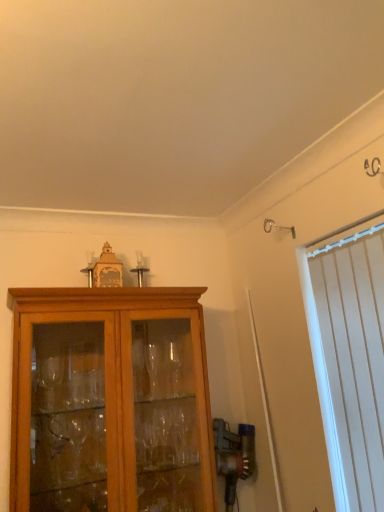
Question: From the image's perspective, is white vertical blinds at right on top of matte wood cabinet at center?

Choices:
 (A) yes
 (B) no

Answer: (A)

Question: Considering the relative sizes of white vertical blinds at right and matte wood cabinet at center in the image provided, is white vertical blinds at right smaller than matte wood cabinet at center?

Choices:
 (A) no
 (B) yes

Answer: (B)

Question: Could you tell me if white vertical blinds at right is turned towards matte wood cabinet at center?

Choices:
 (A) no
 (B) yes

Answer: (A)

Question: Is white vertical blinds at right further to camera compared to matte wood cabinet at center?

Choices:
 (A) yes
 (B) no

Answer: (B)

Question: Is white vertical blinds at right at the left side of matte wood cabinet at center?

Choices:
 (A) no
 (B) yes

Answer: (A)

Question: From a real-world perspective, is white vertical blinds at right physically below matte wood cabinet at center?

Choices:
 (A) yes
 (B) no

Answer: (B)

Question: Considering the relative sizes of matte wood cabinet at center and white vertical blinds at right in the image provided, is matte wood cabinet at center wider than white vertical blinds at right?

Choices:
 (A) no
 (B) yes

Answer: (B)

Question: Does matte wood cabinet at center have a lesser height compared to white vertical blinds at right?

Choices:
 (A) yes
 (B) no

Answer: (A)

Question: Is matte wood cabinet at center to the right of white vertical blinds at right from the viewer's perspective?

Choices:
 (A) yes
 (B) no

Answer: (B)

Question: Is matte wood cabinet at center positioned beyond the bounds of white vertical blinds at right?

Choices:
 (A) no
 (B) yes

Answer: (B)

Question: From the image's perspective, does matte wood cabinet at center appear lower than white vertical blinds at right?

Choices:
 (A) yes
 (B) no

Answer: (A)

Question: Is white vertical blinds at right a part of matte wood cabinet at center?

Choices:
 (A) no
 (B) yes

Answer: (A)

Question: Does point (190, 394) appear closer or farther from the camera than point (339, 335)?

Choices:
 (A) farther
 (B) closer

Answer: (A)